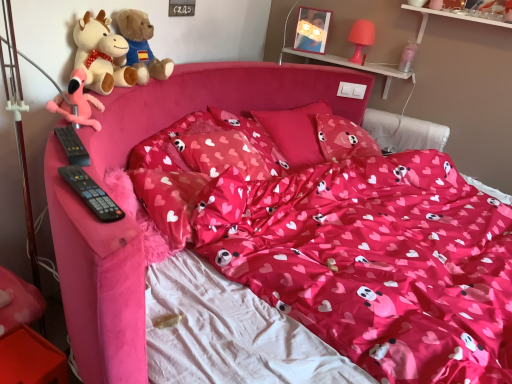
Question: Considering the relative sizes of pink fabric pillow at center, the 2th pillow from the back, and matte pink pillow at center, which is the 2th pillow from front to back, in the image provided, is pink fabric pillow at center, the 2th pillow from the back, taller than matte pink pillow at center, which is the 2th pillow from front to back,?

Choices:
 (A) yes
 (B) no

Answer: (A)

Question: Can you confirm if pink fabric pillow at center, the 2th pillow from the back, is positioned to the left of matte pink pillow at center, which is the 2th pillow from front to back?

Choices:
 (A) no
 (B) yes

Answer: (A)

Question: Is pink fabric pillow at center, which is the third pillow in front-to-back order, positioned in front of matte pink pillow at center, which is the 2th pillow from front to back?

Choices:
 (A) yes
 (B) no

Answer: (B)

Question: Would you say matte pink pillow at center, the 3th pillow in the back-to-front sequence, is part of pink fabric pillow at center, which is the third pillow in front-to-back order,'s contents?

Choices:
 (A) yes
 (B) no

Answer: (B)

Question: From a real-world perspective, is pink fabric pillow at center, which is the third pillow in front-to-back order, over matte pink pillow at center, the 3th pillow in the back-to-front sequence?

Choices:
 (A) no
 (B) yes

Answer: (A)

Question: From a real-world perspective, is black plastic remote control at left, positioned as the first remote control in top-to-bottom order, above or below clear plastic bottle at upper right, which is the 1th toy from back to front?

Choices:
 (A) below
 (B) above

Answer: (A)

Question: Do you think black plastic remote control at left, acting as the second remote control starting from the bottom, is within clear plastic bottle at upper right, the first toy positioned from the top, or outside of it?

Choices:
 (A) outside
 (B) inside

Answer: (A)

Question: Does point (66, 150) appear closer or farther from the camera than point (411, 57)?

Choices:
 (A) farther
 (B) closer

Answer: (B)

Question: Considering the positions of black plastic remote control at left, placed as the 2th remote control when sorted from front to back, and clear plastic bottle at upper right, which is counted as the 2th toy, starting from the front, in the image, is black plastic remote control at left, placed as the 2th remote control when sorted from front to back, taller or shorter than clear plastic bottle at upper right, which is counted as the 2th toy, starting from the front,?

Choices:
 (A) tall
 (B) short

Answer: (B)

Question: Considering their positions, is matte pink pillow at center, which is the 2th pillow from front to back, located in front of or behind pink fabric pillow at center, which is the third pillow in front-to-back order?

Choices:
 (A) behind
 (B) front

Answer: (B)

Question: Does point (250, 178) appear closer or farther from the camera than point (312, 125)?

Choices:
 (A) closer
 (B) farther

Answer: (A)

Question: Would you say matte pink pillow at center, the 3th pillow in the back-to-front sequence, is to the left or to the right of pink fabric pillow at center, the 2th pillow from the back, in the picture?

Choices:
 (A) right
 (B) left

Answer: (B)

Question: Choose the correct answer: Is matte pink pillow at center, the 3th pillow in the back-to-front sequence, inside pink fabric pillow at center, which is the third pillow in front-to-back order, or outside it?

Choices:
 (A) outside
 (B) inside

Answer: (A)

Question: Do you think soft plush teddy bear at upper left, the first teddy bear from the front, is within black plastic remote control at left, which is the second remote control in top-to-bottom order, or outside of it?

Choices:
 (A) outside
 (B) inside

Answer: (A)

Question: Considering their positions, is soft plush teddy bear at upper left, the first teddy bear from the front, located in front of or behind black plastic remote control at left, which is counted as the 1th remote control, starting from the bottom?

Choices:
 (A) behind
 (B) front

Answer: (A)